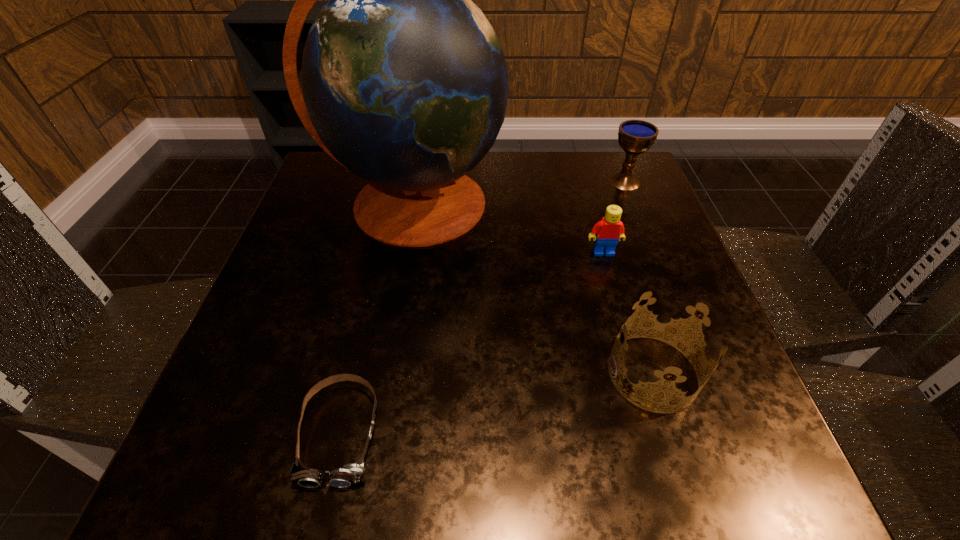
The width and height of the screenshot is (960, 540). I want to click on vacant point that satisfies the following two spatial constraints: 1. on the face of the crown; 2. on the left side of the Lego, so click(637, 373).

The width and height of the screenshot is (960, 540). In order to click on vacant region that satisfies the following two spatial constraints: 1. on the face of the crown; 2. on the left side of the Lego in this screenshot , I will do `click(637, 373)`.